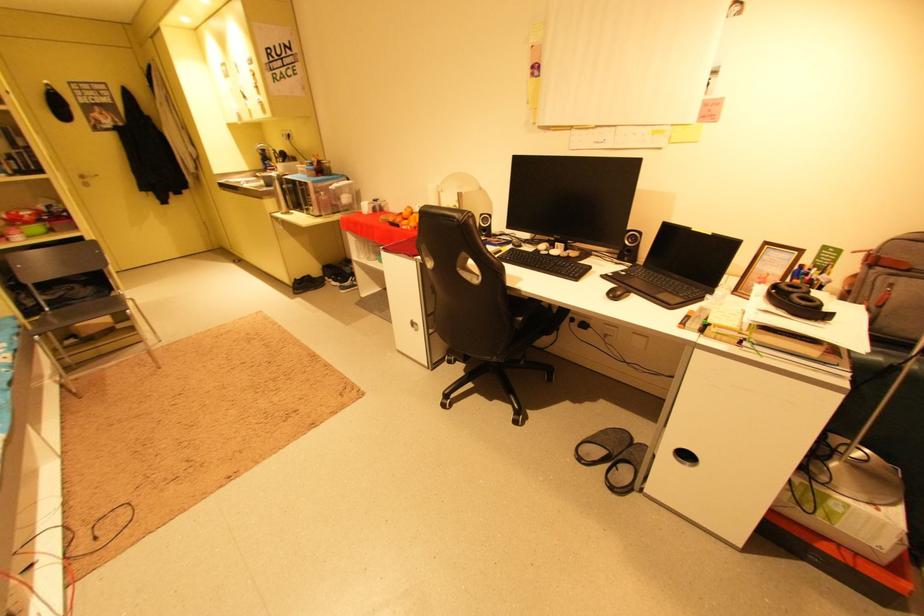
Locate an element on the screen. The image size is (924, 616). clear plastic container is located at coordinates (320, 193).